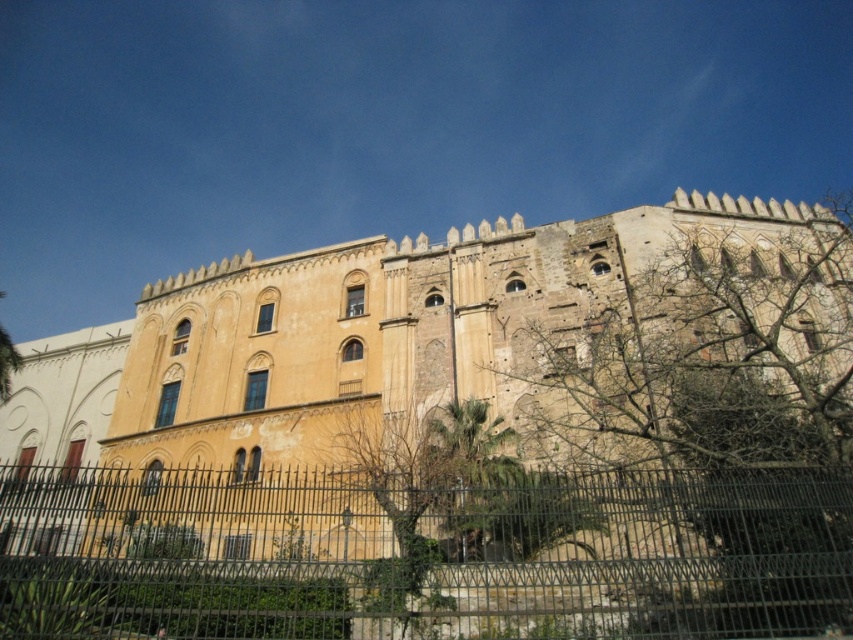
Consider the image. Who is more forward, [688,605] or [775,456]?

Positioned in front is point [688,605].

In the scene shown: Is black metal fence at lower center smaller than bare branches at upper right?

Correct, black metal fence at lower center occupies less space than bare branches at upper right.

Who is more forward, (407, 628) or (781, 600)?

Point (781, 600)

Locate an element on the screen. black metal fence at lower center is located at coordinates (426, 556).

Locate an element on the screen. The width and height of the screenshot is (853, 640). yellow stone building at center is located at coordinates (444, 392).

Does point (671, 445) lie behind point (757, 305)?

That is False.

Is point (317, 349) closer to camera compared to point (723, 476)?

No.

Identify the location of yellow stone building at center. (444, 392).

Is point (814, 298) behind point (132, 534)?

Yes, it is.

Describe the element at coordinates (444, 392) in the screenshot. I see `yellow stone building at center` at that location.

Locate an element on the screen. yellow stone building at center is located at coordinates (444, 392).